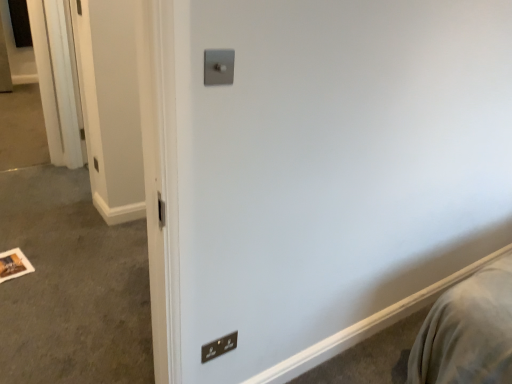
Question: Which direction should I rotate to look at satin silver switch at upper center, marked as the first light switch in a top-to-bottom arrangement?

Choices:
 (A) left
 (B) right

Answer: (A)

Question: Can you confirm if satin silver switch at upper center, which ranks as the second light switch in bottom-to-top order, is smaller than black plastic light switch at lower center, placed as the 2th light switch when sorted from top to bottom?

Choices:
 (A) yes
 (B) no

Answer: (B)

Question: From the image's perspective, is satin silver switch at upper center, arranged as the 2th light switch when viewed from the back, over black plastic light switch at lower center, the 2th light switch in the front-to-back sequence?

Choices:
 (A) yes
 (B) no

Answer: (A)

Question: From the image's perspective, is satin silver switch at upper center, the first light switch positioned from the front, below black plastic light switch at lower center, placed as the 2th light switch when sorted from top to bottom?

Choices:
 (A) no
 (B) yes

Answer: (A)

Question: Is satin silver switch at upper center, which ranks as the second light switch in bottom-to-top order, in front of black plastic light switch at lower center, the 2th light switch in the front-to-back sequence?

Choices:
 (A) no
 (B) yes

Answer: (B)

Question: Is satin silver switch at upper center, arranged as the 2th light switch when viewed from the back, oriented towards black plastic light switch at lower center, the 2th light switch in the front-to-back sequence?

Choices:
 (A) yes
 (B) no

Answer: (B)

Question: Is satin silver switch at upper center, arranged as the 2th light switch when viewed from the back, beside black plastic light switch at lower center, the 2th light switch in the front-to-back sequence?

Choices:
 (A) yes
 (B) no

Answer: (B)

Question: Does black plastic light switch at lower center, positioned as the 1th light switch in bottom-to-top order, turn towards satin silver switch at upper center, the first light switch positioned from the front?

Choices:
 (A) no
 (B) yes

Answer: (A)

Question: From a real-world perspective, is black plastic light switch at lower center, marked as the first light switch in a back-to-front arrangement, physically below satin silver switch at upper center, arranged as the 2th light switch when viewed from the back?

Choices:
 (A) yes
 (B) no

Answer: (A)

Question: Does black plastic light switch at lower center, the 2th light switch in the front-to-back sequence, have a lesser height compared to satin silver switch at upper center, arranged as the 2th light switch when viewed from the back?

Choices:
 (A) yes
 (B) no

Answer: (B)

Question: From a real-world perspective, is black plastic light switch at lower center, the 2th light switch in the front-to-back sequence, located higher than satin silver switch at upper center, marked as the first light switch in a top-to-bottom arrangement?

Choices:
 (A) yes
 (B) no

Answer: (B)

Question: Considering the relative sizes of black plastic light switch at lower center, marked as the first light switch in a back-to-front arrangement, and satin silver switch at upper center, which ranks as the second light switch in bottom-to-top order, in the image provided, is black plastic light switch at lower center, marked as the first light switch in a back-to-front arrangement, bigger than satin silver switch at upper center, which ranks as the second light switch in bottom-to-top order,?

Choices:
 (A) no
 (B) yes

Answer: (A)

Question: Is black plastic light switch at lower center, positioned as the 1th light switch in bottom-to-top order, not near satin silver switch at upper center, marked as the first light switch in a top-to-bottom arrangement?

Choices:
 (A) yes
 (B) no

Answer: (B)

Question: Would you say satin silver switch at upper center, marked as the first light switch in a top-to-bottom arrangement, is to the left or to the right of black plastic light switch at lower center, marked as the first light switch in a back-to-front arrangement, in the picture?

Choices:
 (A) left
 (B) right

Answer: (B)